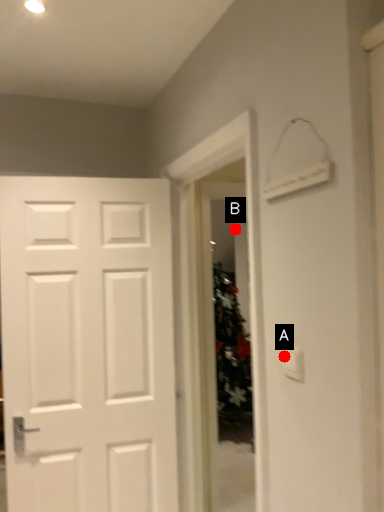
Question: Two points are circled on the image, labeled by A and B beside each circle. Among these points, which one is nearest to the camera?

Choices:
 (A) A is closer
 (B) B is closer

Answer: (A)